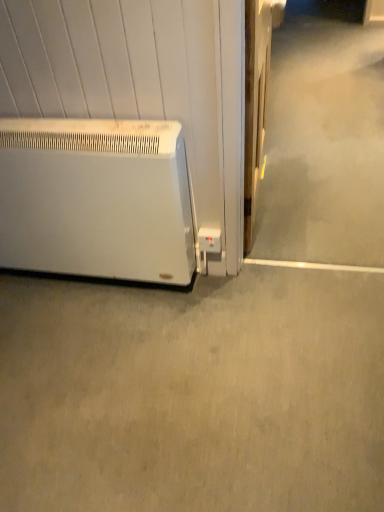
Question: Is white matte heater at lower left positioned behind gray matte concrete at lower left?

Choices:
 (A) no
 (B) yes

Answer: (B)

Question: Is white matte heater at lower left looking in the opposite direction of gray matte concrete at lower left?

Choices:
 (A) no
 (B) yes

Answer: (A)

Question: Does white matte heater at lower left appear on the left side of gray matte concrete at lower left?

Choices:
 (A) yes
 (B) no

Answer: (A)

Question: Does white matte heater at lower left have a lesser width compared to gray matte concrete at lower left?

Choices:
 (A) no
 (B) yes

Answer: (B)

Question: Does white matte heater at lower left have a greater height compared to gray matte concrete at lower left?

Choices:
 (A) no
 (B) yes

Answer: (B)

Question: From a real-world perspective, is white matte heater at lower left below gray matte concrete at lower left?

Choices:
 (A) no
 (B) yes

Answer: (A)

Question: From the image's perspective, does gray matte concrete at lower left appear lower than white matte heater at lower left?

Choices:
 (A) no
 (B) yes

Answer: (B)

Question: Is gray matte concrete at lower left positioned far away from white matte heater at lower left?

Choices:
 (A) no
 (B) yes

Answer: (A)

Question: Is gray matte concrete at lower left in front of white matte heater at lower left?

Choices:
 (A) yes
 (B) no

Answer: (A)

Question: Is gray matte concrete at lower left taller than white matte heater at lower left?

Choices:
 (A) yes
 (B) no

Answer: (B)

Question: Could you tell me if gray matte concrete at lower left is turned towards white matte heater at lower left?

Choices:
 (A) yes
 (B) no

Answer: (B)

Question: Is gray matte concrete at lower left shorter than white matte heater at lower left?

Choices:
 (A) yes
 (B) no

Answer: (A)

Question: Is point (213, 398) closer or farther from the camera than point (125, 263)?

Choices:
 (A) farther
 (B) closer

Answer: (B)